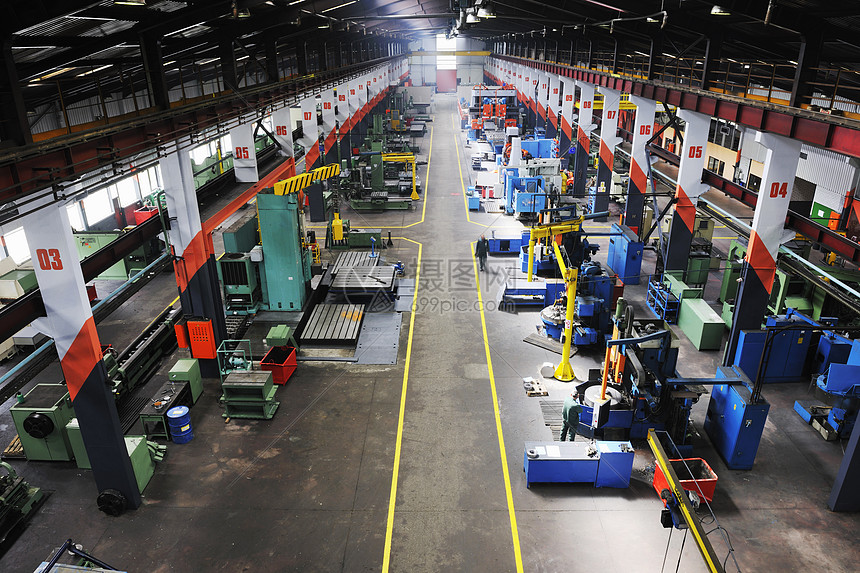
Locate an element on the screen. desk is located at coordinates (579, 473).